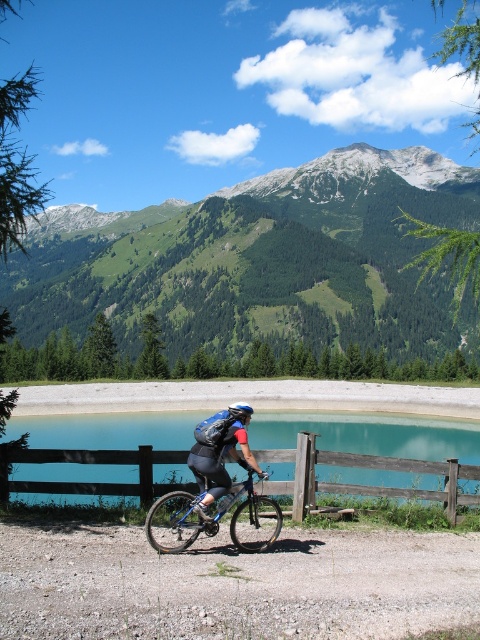
You are a photographer planning to take a photo of the wooden at center and the matte blue helmet at center in the image. If you want to ensure both objects are fully visible in the frame, which object should you focus on to avoid cropping either?

You should focus on the wooden at center because its width is larger than the matte blue helmet at center, so ensuring it fits will automatically accommodate the smaller helmet in the frame.

You are a hiker planning to take a photo of the green forested mountain at upper center and the blue metallic bicycle at center. Which object should you focus on first if you want to capture both in a single frame without moving your camera?

You should focus on the blue metallic bicycle at center first because the green forested mountain at upper center is positioned to its right, so by centering the bicycle in the frame, the mountain will naturally be included on the right side without needing to adjust the camera position.